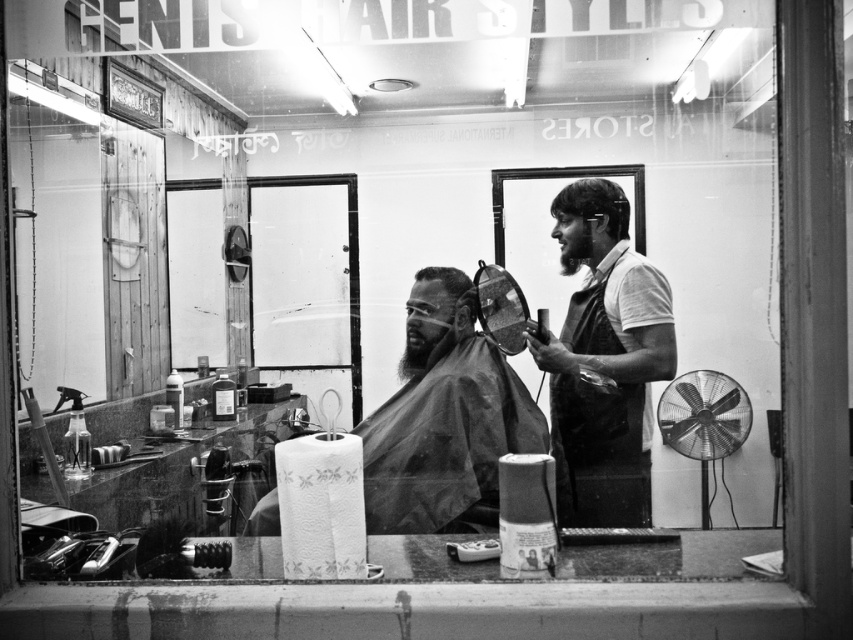
You are a customer standing at the entrance of the barbershop. You want to take a photo of the barber shop name displayed at the top of the frame. The point you need to focus on is point (393, 484). Is this point within the focus range of your camera, which can focus up to 10 feet?

The distance of point (393, 484) from camera is 8.69 feet, which is within the camera focus range of up to 10 feet. Therefore, the point is within the focus range.

You are a customer entering the barbershop and want to get a haircut. You see the bearded man at center and the short dark hair at upper right. Which direction should you go to reach the barber first?

The bearded man at center is positioned on the left side of short dark hair at upper right, so you should go to the left to reach the barber first.